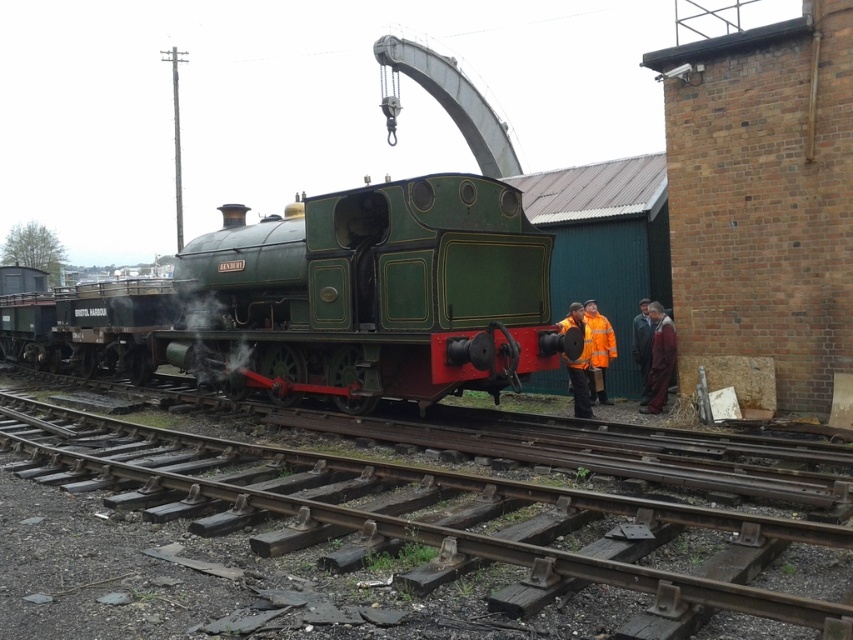
Does green polished wood train at center have a lesser width compared to orange reflective jacket at center?

No, green polished wood train at center is not thinner than orange reflective jacket at center.

Is green polished wood train at center bigger than orange reflective jacket at center?

Indeed, green polished wood train at center has a larger size compared to orange reflective jacket at center.

Identify the location of green polished wood train at center. (325, 301).

How much distance is there between green matte steam at center and hi-visibility jacket at center?

A distance of 6.51 meters exists between green matte steam at center and hi-visibility jacket at center.

Based on the photo, can you confirm if green matte steam at center is positioned below hi-visibility jacket at center?

Incorrect, green matte steam at center is not positioned below hi-visibility jacket at center.

From the picture: Who is more distant from viewer, (x=177, y=324) or (x=585, y=392)?

The point (x=177, y=324) is more distant.

Where is `green matte steam at center`? The height and width of the screenshot is (640, 853). green matte steam at center is located at coordinates (207, 340).

Which is below, rusty metal track at center or dark blue fabric coat at right?

rusty metal track at center

Describe the element at coordinates (416, 509) in the screenshot. I see `rusty metal track at center` at that location.

Locate an element on the screen. This screenshot has height=640, width=853. rusty metal track at center is located at coordinates (416, 509).